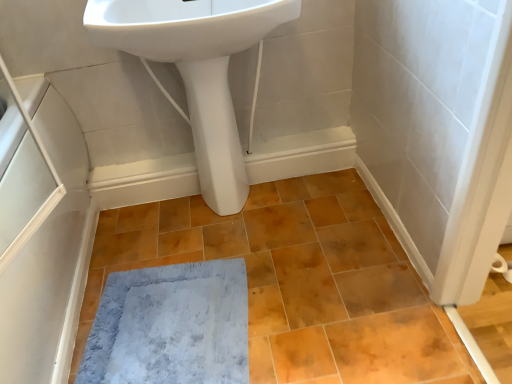
Measure the distance between white glossy pedestal at center and camera.

white glossy pedestal at center and camera are 4.24 feet apart.

What do you see at coordinates (170, 326) in the screenshot? I see `gray plush bath mat at lower center` at bounding box center [170, 326].

This screenshot has height=384, width=512. What do you see at coordinates (38, 227) in the screenshot?
I see `white matte screen door at left` at bounding box center [38, 227].

Find the location of a particular element. Image resolution: width=512 pixels, height=384 pixels. white glossy pedestal at center is located at coordinates (215, 135).

Between gray plush bath mat at lower center and white glossy pedestal at center, which one appears on the left side from the viewer's perspective?

From the viewer's perspective, gray plush bath mat at lower center appears more on the left side.

Is gray plush bath mat at lower center not near white glossy pedestal at center?

Actually, gray plush bath mat at lower center and white glossy pedestal at center are a little close together.

Is gray plush bath mat at lower center facing towards white glossy pedestal at center?

No.

Considering the sizes of objects gray plush bath mat at lower center and white glossy pedestal at center in the image provided, who is taller, gray plush bath mat at lower center or white glossy pedestal at center?

With more height is white glossy pedestal at center.

Considering the relative sizes of matte orange ceramic tile at center and white glossy sink at upper center in the image provided, is matte orange ceramic tile at center thinner than white glossy sink at upper center?

Incorrect, the width of matte orange ceramic tile at center is not less than that of white glossy sink at upper center.

Can you confirm if matte orange ceramic tile at center is positioned to the right of white glossy sink at upper center?

Yes, matte orange ceramic tile at center is to the right of white glossy sink at upper center.

From a real-world perspective, is matte orange ceramic tile at center over white glossy sink at upper center?

No, from a real-world perspective, matte orange ceramic tile at center is not above white glossy sink at upper center.

Is point (442, 369) in front of point (136, 5)?

Yes, point (442, 369) is in front of point (136, 5).

Is white matte screen door at left facing away from white glossy pedestal at center?

No.

In the image, is white matte screen door at left on the left side or the right side of white glossy pedestal at center?

Clearly, white matte screen door at left is on the left of white glossy pedestal at center in the image.

Considering their positions, is white matte screen door at left located in front of or behind white glossy pedestal at center?

In the image, white matte screen door at left appears in front of white glossy pedestal at center.

From a real-world perspective, is white matte screen door at left on top of white glossy pedestal at center?

Yes, from a real-world perspective, white matte screen door at left is on top of white glossy pedestal at center.

Measure the distance between matte orange ceramic tile at center and white matte screen door at left.

20.20 inches.

Image resolution: width=512 pixels, height=384 pixels. I want to click on screen door located on the left of matte orange ceramic tile at center, so click(38, 227).

Which object is further away from the camera taking this photo, matte orange ceramic tile at center or white matte screen door at left?

matte orange ceramic tile at center.

Between white glossy pedestal at center and white matte screen door at left, which one is positioned in front?

white matte screen door at left.

Does point (224, 152) come in front of point (35, 250)?

No, (224, 152) is behind (35, 250).

The image size is (512, 384). Find the location of `screen door to the left of white glossy pedestal at center`. screen door to the left of white glossy pedestal at center is located at coordinates (38, 227).

Is white glossy pedestal at center taller or shorter than white matte screen door at left?

Considering their sizes, white glossy pedestal at center has more height than white matte screen door at left.

Which is nearer, (40, 380) or (135, 11)?

Point (40, 380).

Based on the photo, which is correct: white matte screen door at left is inside white glossy sink at upper center, or outside of it?

white matte screen door at left is not inside white glossy sink at upper center, it's outside.

Is white matte screen door at left facing towards white glossy sink at upper center?

No, white matte screen door at left does not turn towards white glossy sink at upper center.

Is white matte screen door at left in front of or behind white glossy sink at upper center in the image?

Clearly, white matte screen door at left is in front of white glossy sink at upper center.

From the image's perspective, does white glossy sink at upper center appear higher than white glossy pedestal at center?

Correct, white glossy sink at upper center appears higher than white glossy pedestal at center in the image.

Is white glossy sink at upper center oriented towards white glossy pedestal at center?

No, white glossy sink at upper center is not facing towards white glossy pedestal at center.

Does point (225, 6) appear closer or farther from the camera than point (215, 124)?

Clearly, point (225, 6) is closer to the camera than point (215, 124).

Identify the location of bidet behind the gray plush bath mat at lower center. (215, 135).

In the image, there is a white glossy sink at upper center. Identify the location of ceramic tile below it (from a real-world perspective). click(x=298, y=281).

Consider the image. Looking at the image, which one is located closer to gray plush bath mat at lower center, white glossy pedestal at center or white matte screen door at left?

Among the two, white matte screen door at left is located nearer to gray plush bath mat at lower center.

Based on their spatial positions, is white glossy pedestal at center or white matte screen door at left further from matte orange ceramic tile at center?

white matte screen door at left is further to matte orange ceramic tile at center.

Looking at the image, which one is located closer to matte orange ceramic tile at center, white glossy pedestal at center or gray plush bath mat at lower center?

gray plush bath mat at lower center lies closer to matte orange ceramic tile at center than the other object.

When comparing their distances from white glossy sink at upper center, does white glossy pedestal at center or gray plush bath mat at lower center seem further?

The object further to white glossy sink at upper center is gray plush bath mat at lower center.

When comparing their distances from white glossy pedestal at center, does white glossy sink at upper center or gray plush bath mat at lower center seem closer?

Based on the image, white glossy sink at upper center appears to be nearer to white glossy pedestal at center.

From the image, which object appears to be nearer to white glossy sink at upper center, white matte screen door at left or white glossy pedestal at center?

white glossy pedestal at center is positioned closer to the anchor white glossy sink at upper center.

Based on their spatial positions, is white glossy sink at upper center or matte orange ceramic tile at center closer to white glossy pedestal at center?

white glossy sink at upper center is positioned closer to the anchor white glossy pedestal at center.

From the image, which object appears to be farther from matte orange ceramic tile at center, gray plush bath mat at lower center or white glossy sink at upper center?

The object further to matte orange ceramic tile at center is white glossy sink at upper center.

I want to click on bath mat between white matte screen door at left and matte orange ceramic tile at center, so click(x=170, y=326).

Locate an element on the screen. This screenshot has height=384, width=512. bidet situated between white matte screen door at left and matte orange ceramic tile at center from left to right is located at coordinates (215, 135).

Image resolution: width=512 pixels, height=384 pixels. What are the coordinates of `ceramic tile between white glossy pedestal at center and gray plush bath mat at lower center vertically` in the screenshot? It's located at (298, 281).

Where is `ceramic tile between white glossy sink at upper center and gray plush bath mat at lower center in the up-down direction`? ceramic tile between white glossy sink at upper center and gray plush bath mat at lower center in the up-down direction is located at coordinates (298, 281).